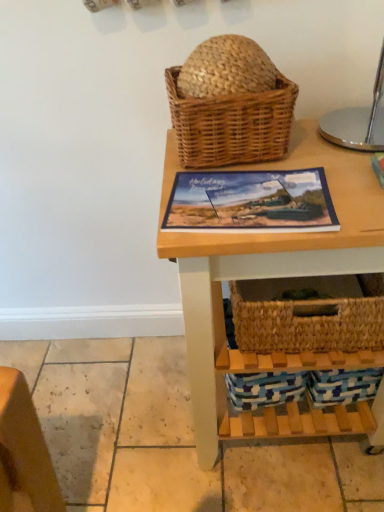
Question: Considering the relative sizes of matte plastic picture frame at center and woven brown picnic basket at upper center in the image provided, is matte plastic picture frame at center wider than woven brown picnic basket at upper center?

Choices:
 (A) yes
 (B) no

Answer: (B)

Question: Is matte plastic picture frame at center looking in the opposite direction of woven brown picnic basket at upper center?

Choices:
 (A) yes
 (B) no

Answer: (A)

Question: From the image's perspective, is matte plastic picture frame at center located beneath woven brown picnic basket at upper center?

Choices:
 (A) yes
 (B) no

Answer: (A)

Question: Considering the relative sizes of matte plastic picture frame at center and woven brown picnic basket at upper center in the image provided, is matte plastic picture frame at center smaller than woven brown picnic basket at upper center?

Choices:
 (A) no
 (B) yes

Answer: (B)

Question: Is matte plastic picture frame at center facing towards woven brown picnic basket at upper center?

Choices:
 (A) yes
 (B) no

Answer: (B)

Question: Looking at their shapes, would you say woven brown picnic basket at upper center is wider or thinner than natural wood table at center?

Choices:
 (A) wide
 (B) thin

Answer: (B)

Question: Considering the positions of point (178, 74) and point (344, 246), is point (178, 74) closer or farther from the camera than point (344, 246)?

Choices:
 (A) closer
 (B) farther

Answer: (B)

Question: Considering the relative positions of woven brown picnic basket at upper center and natural wood table at center in the image provided, is woven brown picnic basket at upper center to the left or to the right of natural wood table at center?

Choices:
 (A) left
 (B) right

Answer: (A)

Question: Would you say woven brown picnic basket at upper center is inside or outside natural wood table at center?

Choices:
 (A) inside
 (B) outside

Answer: (B)

Question: From a real-world perspective, is natural wood table at center physically located above or below woven brown picnic basket at upper center?

Choices:
 (A) above
 (B) below

Answer: (B)

Question: From the image's perspective, relative to woven brown picnic basket at upper center, is natural wood table at center above or below?

Choices:
 (A) below
 (B) above

Answer: (A)

Question: Would you say natural wood table at center is inside or outside woven brown picnic basket at upper center?

Choices:
 (A) outside
 (B) inside

Answer: (A)

Question: Does point tap(297, 267) appear closer or farther from the camera than point tap(210, 142)?

Choices:
 (A) closer
 (B) farther

Answer: (A)

Question: Visually, is natural wood table at center positioned to the left or to the right of matte plastic picture frame at center?

Choices:
 (A) left
 (B) right

Answer: (B)

Question: From the image's perspective, is natural wood table at center located above or below matte plastic picture frame at center?

Choices:
 (A) above
 (B) below

Answer: (B)